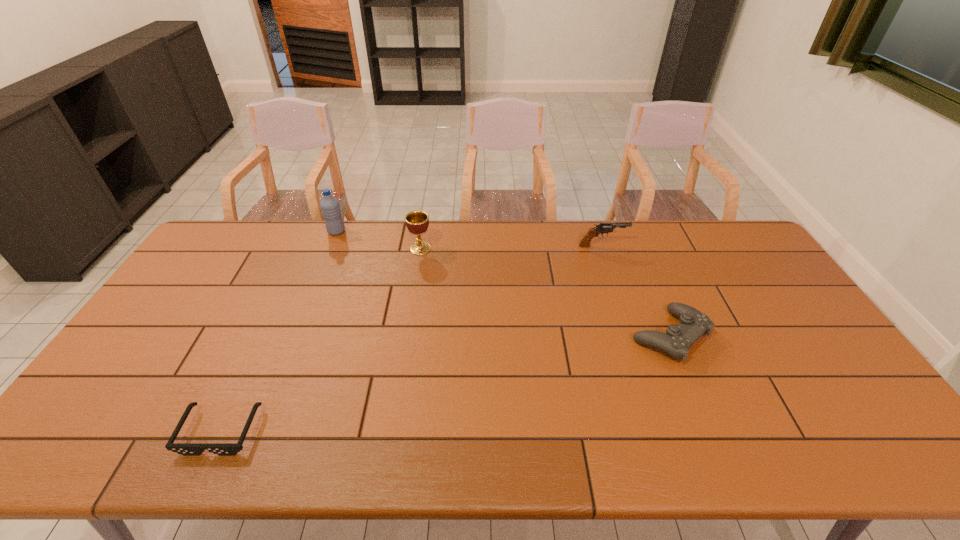
What are the coordinates of `free space between the third shortest object and the second tallest object` in the screenshot? It's located at (512, 247).

The height and width of the screenshot is (540, 960). I want to click on vacant area between the third object from right to left and the nearest object, so tap(321, 340).

Identify the location of object that is the second closest to the water bottle. (186, 449).

Locate which object ranks third in proximity to the fourth farthest object. Please provide its 2D coordinates. Your answer should be formatted as a tuple, i.e. [(x, y)], where the tuple contains the x and y coordinates of a point satisfying the conditions above.

[(186, 449)]

Find the location of a particular element. This screenshot has height=540, width=960. free space that satisfies the following two spatial constraints: 1. on the back side of the second nearest object; 2. along the barrel of the third shortest object is located at coordinates (632, 246).

Where is `free space that satisfies the following two spatial constraints: 1. on the front side of the second tallest object; 2. on the left side of the fourth farthest object`? The image size is (960, 540). free space that satisfies the following two spatial constraints: 1. on the front side of the second tallest object; 2. on the left side of the fourth farthest object is located at coordinates (406, 336).

The height and width of the screenshot is (540, 960). In order to click on free spot that satisfies the following two spatial constraints: 1. along the barrel of the gun; 2. on the front-facing side of the sunglasses in this screenshot , I will do `click(664, 431)`.

Identify the location of vacant space that satisfies the following two spatial constraints: 1. along the barrel of the gun; 2. on the left side of the fourth tallest object. The width and height of the screenshot is (960, 540). (633, 336).